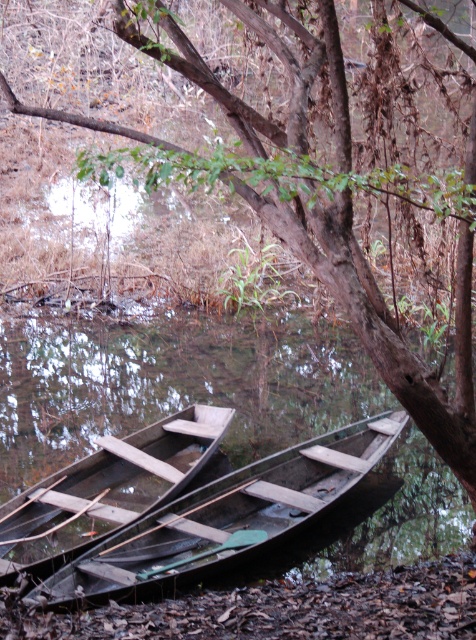
Who is higher up, dark brown wooden boat at lower center or wooden boat at lower left?

wooden boat at lower left

What do you see at coordinates (225, 518) in the screenshot?
I see `dark brown wooden boat at lower center` at bounding box center [225, 518].

This screenshot has width=476, height=640. Describe the element at coordinates (225, 518) in the screenshot. I see `dark brown wooden boat at lower center` at that location.

Image resolution: width=476 pixels, height=640 pixels. In order to click on dark brown wooden boat at lower center in this screenshot , I will do `click(225, 518)`.

Looking at this image, can you confirm if dark wood boat at center is positioned above dark brown wooden boat at lower center?

Correct, dark wood boat at center is located above dark brown wooden boat at lower center.

Locate an element on the screen. This screenshot has width=476, height=640. dark wood boat at center is located at coordinates (171, 381).

Is point (255, 337) more distant than point (172, 552)?

Yes, point (255, 337) is farther from viewer.

Find the location of a particular element. The height and width of the screenshot is (640, 476). dark wood boat at center is located at coordinates (171, 381).

Based on the photo, is dark wood boat at center taller than wooden boat at lower left?

In fact, dark wood boat at center may be shorter than wooden boat at lower left.

Which is more to the right, dark wood boat at center or wooden boat at lower left?

wooden boat at lower left

Locate an element on the screen. The image size is (476, 640). dark wood boat at center is located at coordinates (171, 381).